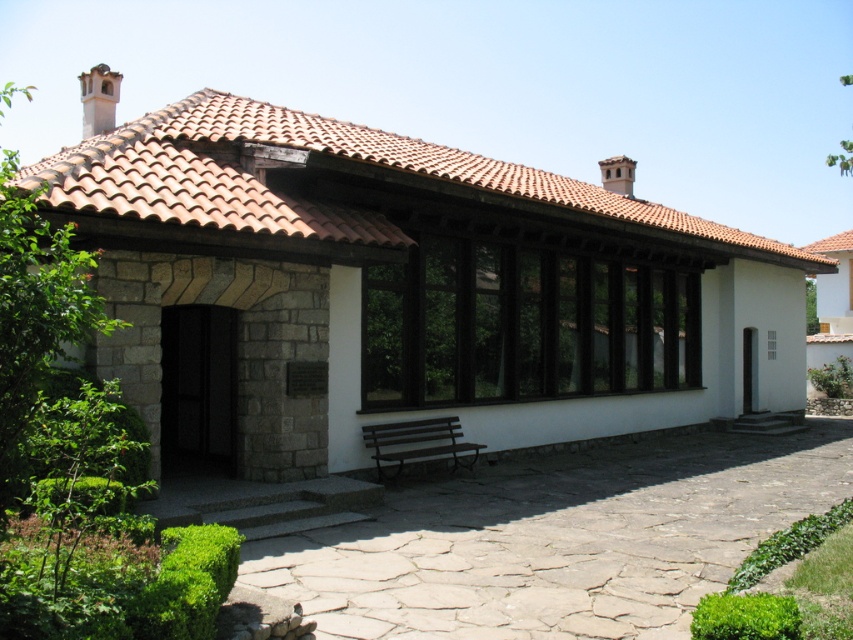
You are standing in front of the traditional building and notice two points marked on its facade. The first point is at coordinates point (265, 129) and the second is at point (453, 422). Which of these two points is closer to your current position?

Point (265, 129) is closer to the camera than point (453, 422), so the first point is closer to your current position.

From the picture: You are a visitor standing in front of the traditional building. You notice the brown tile roof at upper center and the brown wooden bench at lower center. Which object is bigger in size?

The brown tile roof at upper center is larger in size than the brown wooden bench at lower center.